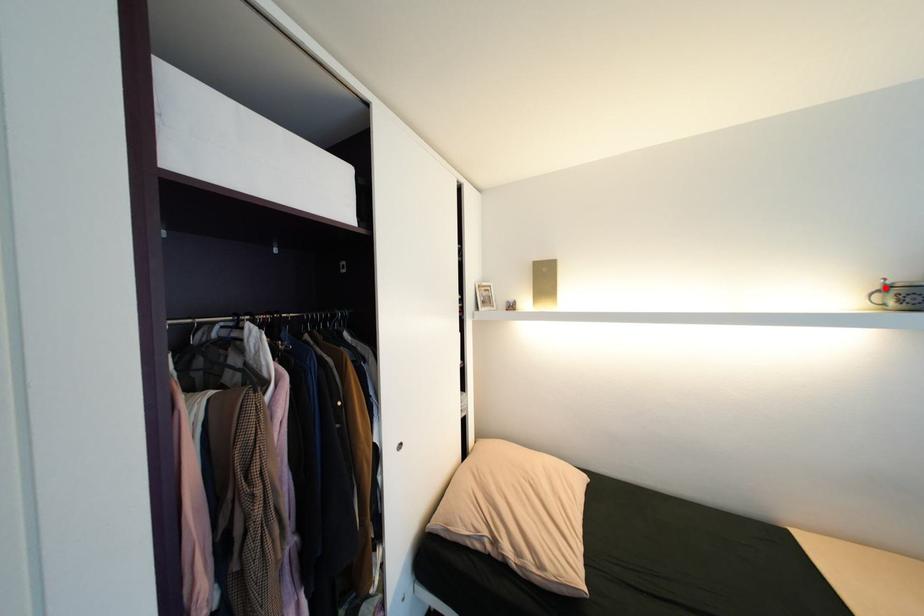
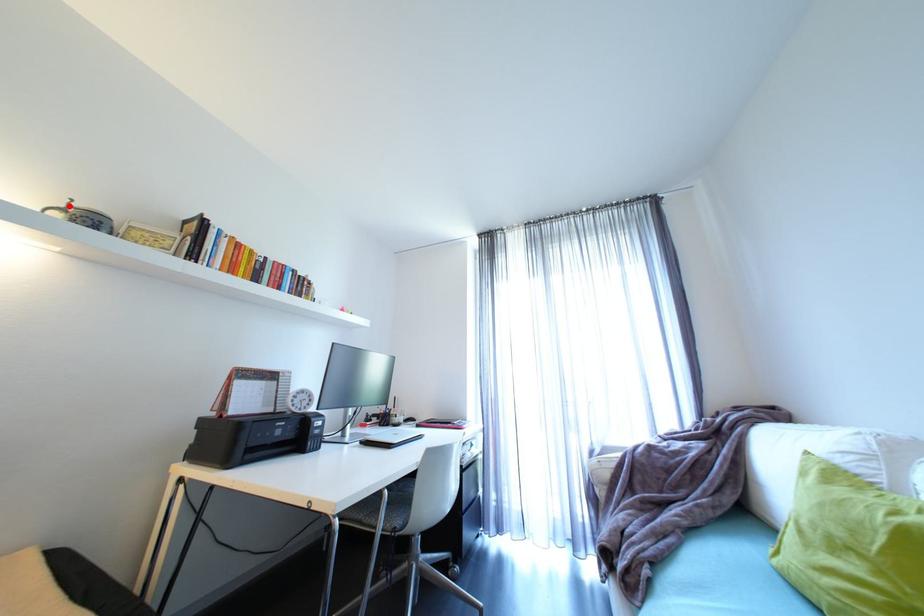
I am providing you with two images of the same scene from different viewpoints. A red point is marked on the first image and another point is marked on the second image. Is the red point in image1 aligned with the point shown in image2?

Yes